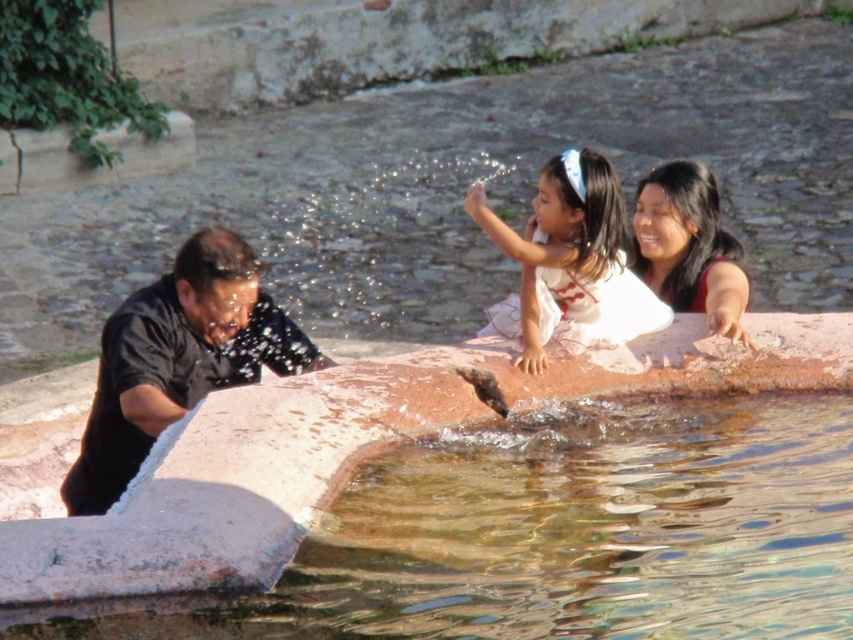
You are standing at the edge of the fountain and see the clear water at fountain left and the white satin dress at center. Which object is positioned lower in the scene?

The clear water at fountain left is located below the white satin dress at center, so it is positioned lower in the scene.

You are standing at the edge of the fountain and want to place a small decorative stone. You have two options for placement locations based on the clear water at fountain left and the smooth red dress at upper right. Which location would allow the stone to be more visible to someone approaching from the front of the fountain?

The smooth red dress at upper right is larger than the clear water at fountain left, so placing the stone near the smooth red dress at upper right would make it more visible to someone approaching from the front of the fountain.

You are standing at the edge of the fountain and want to place a small decorative stone between the clear water at fountain left and the smooth red dress at upper right. Which object should you place it closer to if you want the stone to be submerged in water?

The clear water at fountain left is shorter than the smooth red dress at upper right. To submerge the stone in water, place it closer to the clear water at fountain left since it has a lower water level compared to the other area.